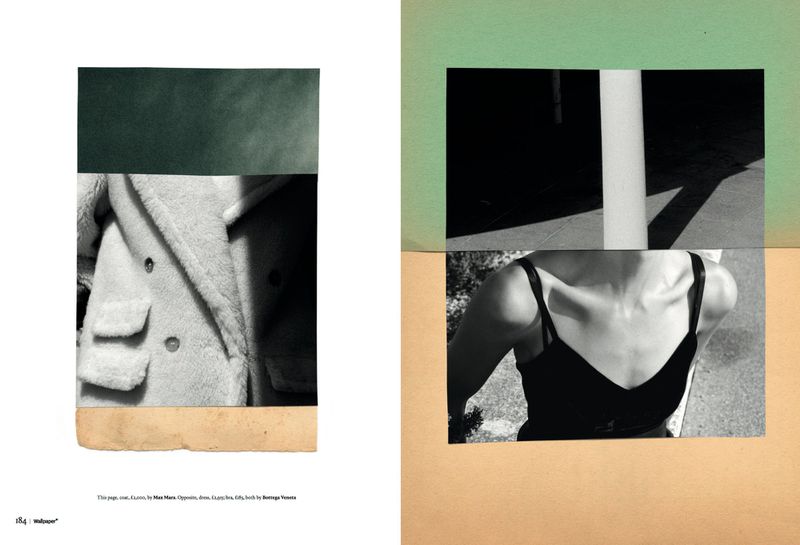
Locate an element on the screen. This screenshot has height=545, width=800. coat is located at coordinates (170, 290).